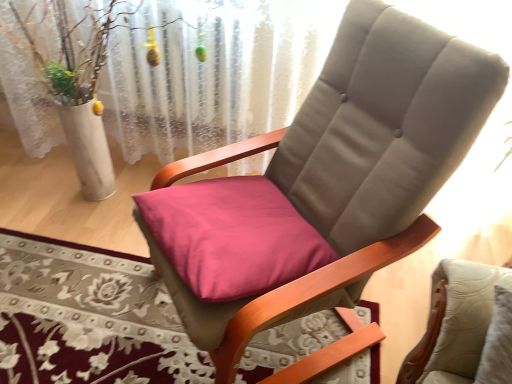
In order to click on space that is in front of white lace curtain at upper center in this screenshot , I will do `click(94, 297)`.